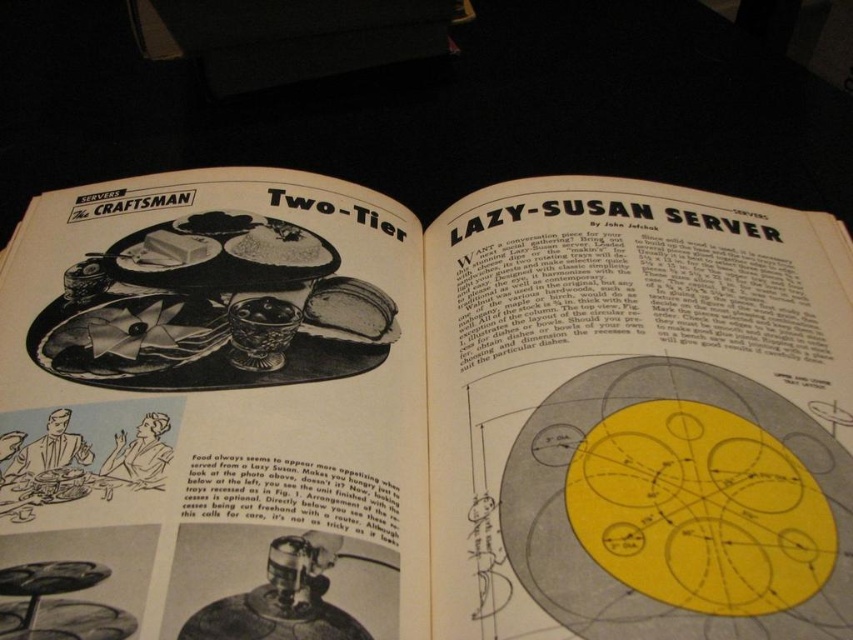
Is yellow paper lazy susan server at upper right bigger than yellow paper circle at center?

Correct, yellow paper lazy susan server at upper right is larger in size than yellow paper circle at center.

Which is in front, point (590, 536) or point (572, 564)?

Point (572, 564) is more forward.

This screenshot has width=853, height=640. Identify the location of yellow paper lazy susan server at upper right. (422, 413).

Identify the location of yellow paper lazy susan server at upper right. (422, 413).